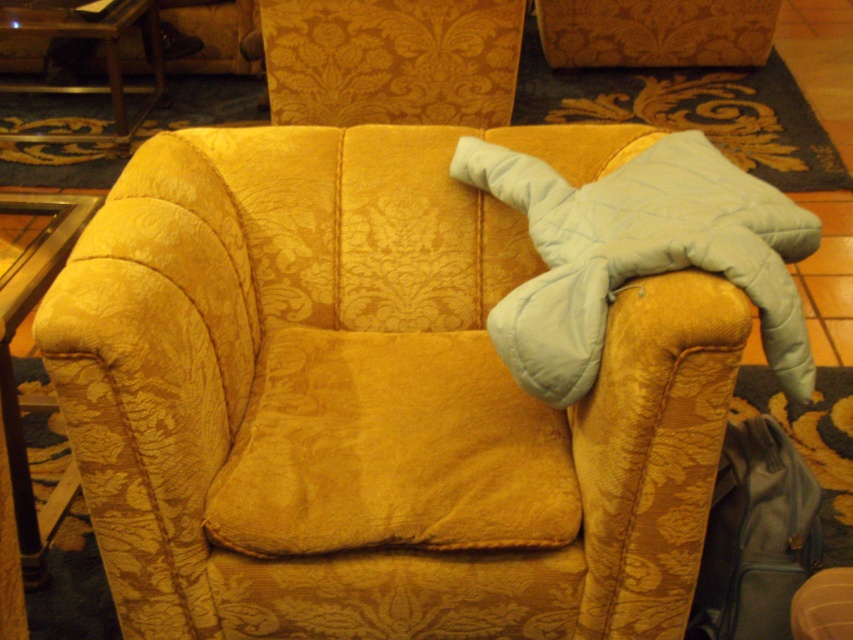
You are organizing a small event and need to place a 30 cm tall vase between the velvet yellow pillow at center and the leather suitcase at lower right. Can the vase fit vertically between them?

The velvet yellow pillow at center is located above the leather suitcase at lower right, so there is vertical space between them. Since the vase is 30 cm tall, it can be placed vertically between the velvet yellow pillow at center and the leather suitcase at lower right as long as the distance between them allows for the vase height.

You are moving into a new apartment and need to place the velvet gold couch at center and the leather suitcase at lower right in your living room. Given their sizes, which one should you place closer to the entrance for easier access to the suitcase?

The leather suitcase at lower right is smaller than the velvet gold couch at center, so you should place the leather suitcase at lower right closer to the entrance to ensure easier access.

You are standing in the room and want to determine which of the two points, point (563, 602) or point (714, 502), is nearer to you. Based on the scene, which point is closer?

Point (563, 602) is closer to the viewer than point (714, 502).